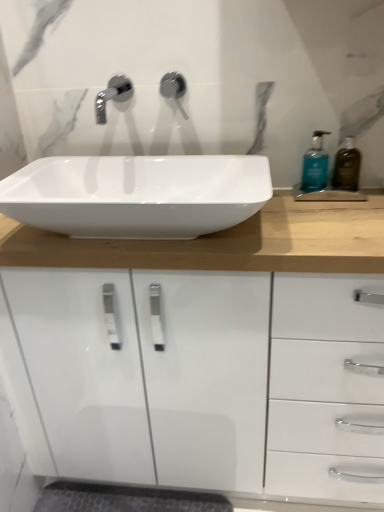
Question: From a real-world perspective, is white glossy sink at center positioned over translucent amber bottle at right, marked as the 2th soap dispenser in a left-to-right arrangement, based on gravity?

Choices:
 (A) yes
 (B) no

Answer: (B)

Question: Is white glossy sink at center at the right side of translucent amber bottle at right, which ranks as the first soap dispenser in right-to-left order?

Choices:
 (A) yes
 (B) no

Answer: (B)

Question: From the image's perspective, does white glossy sink at center appear lower than translucent amber bottle at right, marked as the 2th soap dispenser in a left-to-right arrangement?

Choices:
 (A) yes
 (B) no

Answer: (A)

Question: Is white glossy sink at center beside translucent amber bottle at right, which ranks as the first soap dispenser in right-to-left order?

Choices:
 (A) yes
 (B) no

Answer: (B)

Question: Is white glossy sink at center closer to camera compared to translucent amber bottle at right, which ranks as the first soap dispenser in right-to-left order?

Choices:
 (A) yes
 (B) no

Answer: (A)

Question: Is white glossy sink at center to the left of translucent amber bottle at right, which ranks as the first soap dispenser in right-to-left order, from the viewer's perspective?

Choices:
 (A) no
 (B) yes

Answer: (B)

Question: Considering the relative sizes of matte silver faucet at upper center and white glossy sink at center in the image provided, is matte silver faucet at upper center wider than white glossy sink at center?

Choices:
 (A) yes
 (B) no

Answer: (B)

Question: Is matte silver faucet at upper center beside white glossy sink at center?

Choices:
 (A) no
 (B) yes

Answer: (A)

Question: From a real-world perspective, is matte silver faucet at upper center positioned under white glossy sink at center based on gravity?

Choices:
 (A) yes
 (B) no

Answer: (B)

Question: Is white glossy sink at center completely or partially inside matte silver faucet at upper center?

Choices:
 (A) yes
 (B) no

Answer: (B)

Question: Can you confirm if matte silver faucet at upper center is thinner than white glossy sink at center?

Choices:
 (A) yes
 (B) no

Answer: (A)

Question: Is matte silver faucet at upper center located outside white glossy sink at center?

Choices:
 (A) yes
 (B) no

Answer: (A)

Question: From a real-world perspective, is translucent amber bottle at right, marked as the 2th soap dispenser in a left-to-right arrangement, below teal glass soap dispenser at right, the first soap dispenser positioned from the left?

Choices:
 (A) no
 (B) yes

Answer: (B)